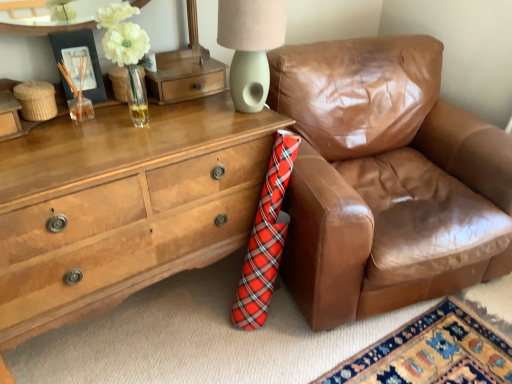
I want to click on vacant area that is in front of matte green ceramic lampshade at upper center, so click(219, 131).